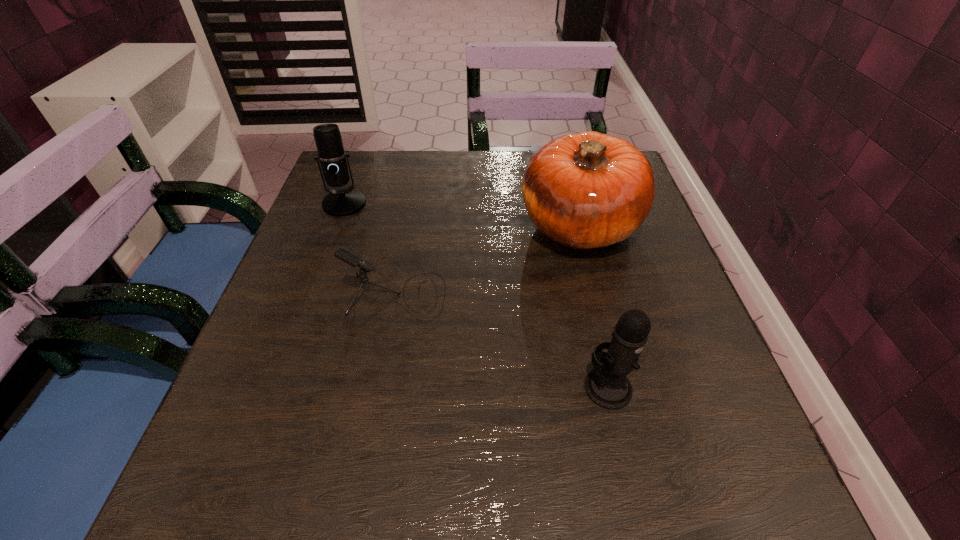
The image size is (960, 540). I want to click on free spot at the far left corner of the desktop, so click(392, 163).

The image size is (960, 540). In order to click on vacant region at the near left corner of the desktop in this screenshot , I will do `click(259, 458)`.

You are a GUI agent. You are given a task and a screenshot of the screen. Output one action in this format:
    pyautogui.click(x=<x>, y=<y>)
    Task: Click on the free space at the near right corner of the desktop
    This screenshot has width=960, height=540.
    Given the screenshot: What is the action you would take?
    pyautogui.click(x=727, y=512)

The width and height of the screenshot is (960, 540). Find the location of `free space between the shortest object and the leftmost microphone`. free space between the shortest object and the leftmost microphone is located at coordinates (370, 249).

The width and height of the screenshot is (960, 540). In order to click on free space between the pumpkin and the nearest microphone in this screenshot , I will do `click(594, 306)`.

What are the coordinates of `free space between the second microphone from left to right and the nearest microphone` in the screenshot? It's located at (x=502, y=341).

Identify the location of free space between the second object from left to right and the rightmost microphone. (502, 341).

What are the coordinates of `empty location between the nearest microphone and the leftmost microphone` in the screenshot? It's located at (476, 295).

Locate an element on the screen. free space that is in between the pumpkin and the nearest microphone is located at coordinates [594, 306].

This screenshot has height=540, width=960. What are the coordinates of `empty space that is in between the pumpkin and the farthest microphone` in the screenshot? It's located at (462, 214).